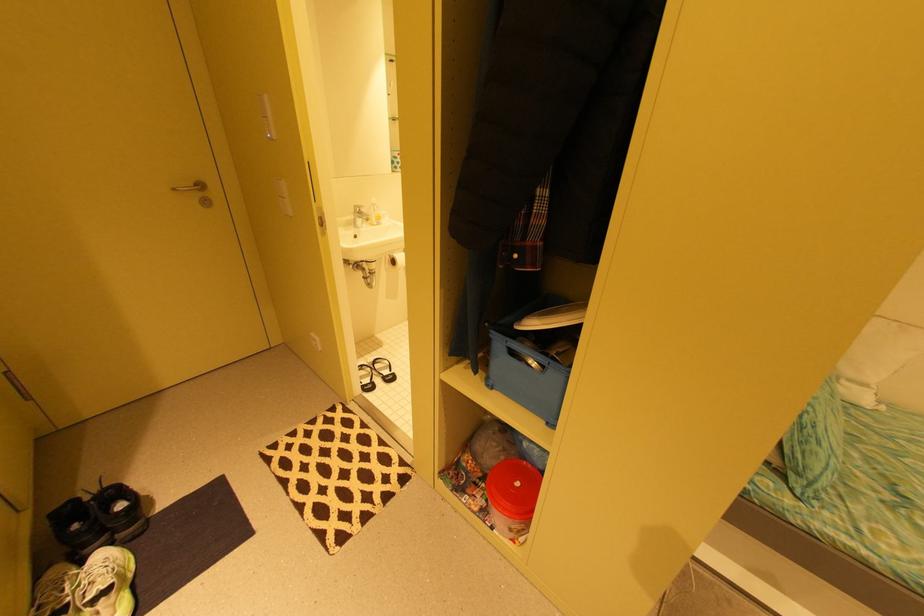
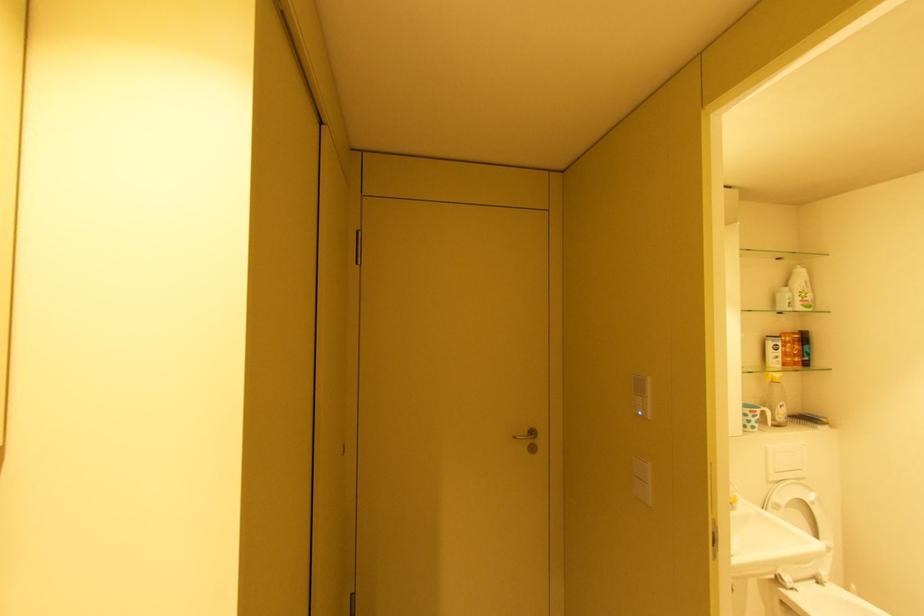
Find the pixel in the second image that matches pixel 179 190 in the first image.

(520, 438)